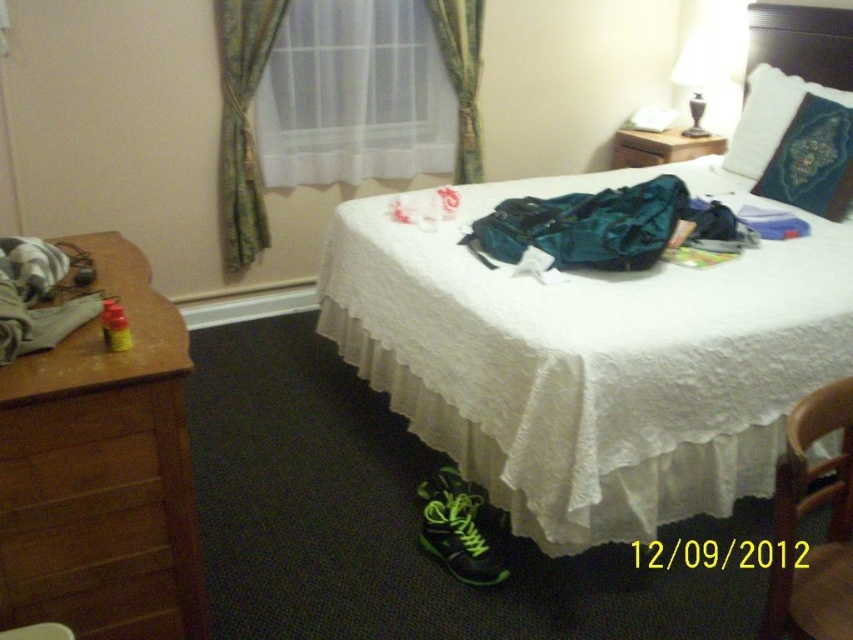
You are organizing the bedroom and want to place a new decorative item on the surface that can accommodate larger items. Which surface should you choose between the green velvet pillow at upper right and the wooden drawer at upper right?

The green velvet pillow at upper right is larger than the wooden drawer at upper right, so it can accommodate larger items.

You are trying to place a rectangular box that is 12 inches wide on the upper right area of the image. The box must fit entirely within either the green velvet pillow at upper right or the wooden drawer at upper right. Which object can the box fit into, if any?

The green velvet pillow at upper right might be wider than wooden drawer at upper right, so if the pillow is indeed wider than 12 inches, the box could fit there. However, since the wooden drawer at upper right is narrower, it might not accommodate the box. Without exact measurements, it is uncertain, but the pillow has a better chance if its width meets or exceeds 12 inches.